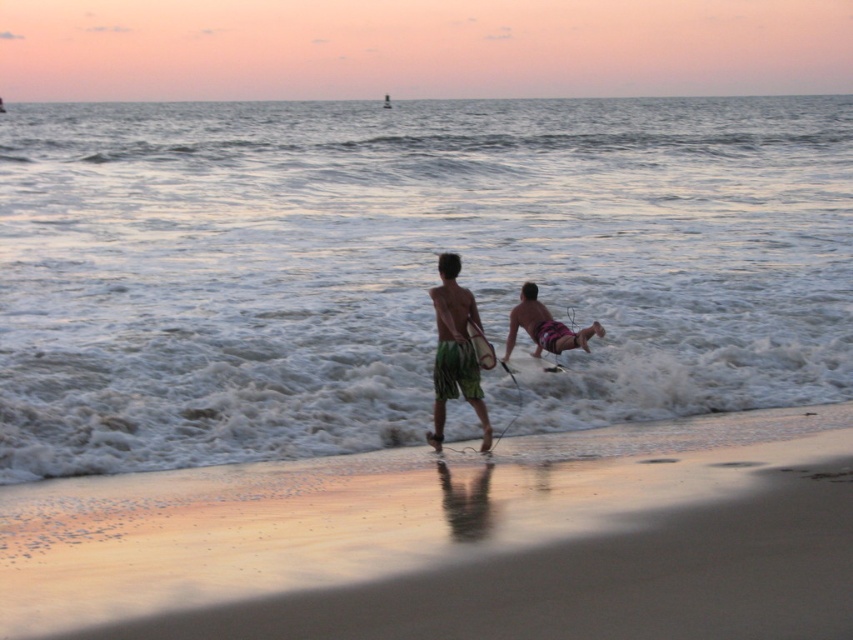
Who is positioned more to the right, sandy beach at lower center or green textured shorts at center?

green textured shorts at center is more to the right.

Is sandy beach at lower center to the left of green textured shorts at center from the viewer's perspective?

Correct, you'll find sandy beach at lower center to the left of green textured shorts at center.

Is point (401, 595) closer to viewer compared to point (439, 260)?

That is True.

At what (x,y) coordinates should I click in order to perform the action: click on sandy beach at lower center. Please return your answer as a coordinate pair (x, y). This screenshot has height=640, width=853. Looking at the image, I should click on (457, 540).

Identify the location of green textured shorts at center. (456, 352).

Is point (459, 285) behind point (469, 339)?

That is False.

At what (x,y) coordinates should I click in order to perform the action: click on green textured shorts at center. Please return your answer as a coordinate pair (x, y). Looking at the image, I should click on (456, 352).

Does pink fabric surfboard at center appear under smooth brown surfboard at center?

No, pink fabric surfboard at center is not below smooth brown surfboard at center.

Between pink fabric surfboard at center and smooth brown surfboard at center, which one is positioned higher?

pink fabric surfboard at center is higher up.

Locate an element on the screen. This screenshot has width=853, height=640. pink fabric surfboard at center is located at coordinates coord(544,326).

Identify the location of pink fabric surfboard at center. (544, 326).